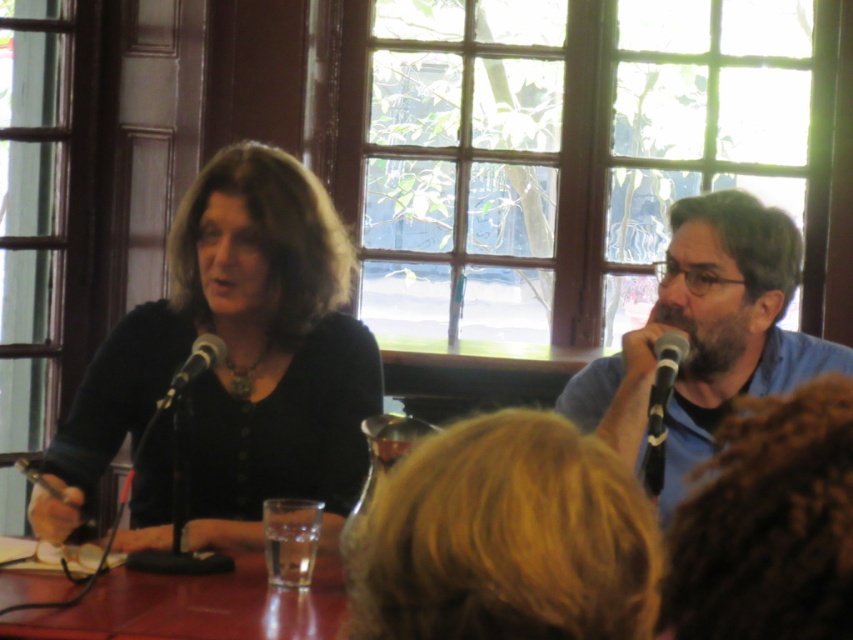
Question: Estimate the real-world distances between objects in this image. Which object is closer to the black metallic microphone at left?

Choices:
 (A) matte black shirt at center
 (B) blue matte shirt at right

Answer: (A)

Question: Which object is positioned closest to the transparent glass table at center?

Choices:
 (A) matte black shirt at center
 (B) black metallic microphone at left
 (C) black plastic microphone at right
 (D) blue matte shirt at right

Answer: (A)

Question: Which of the following is the farthest from the observer?

Choices:
 (A) (242, 250)
 (B) (167, 404)

Answer: (A)

Question: Can you confirm if matte black shirt at center is positioned below transparent glass table at center?

Choices:
 (A) no
 (B) yes

Answer: (A)

Question: Does transparent glass table at center have a lesser width compared to black plastic microphone at right?

Choices:
 (A) no
 (B) yes

Answer: (A)

Question: Does matte black shirt at center have a lesser width compared to black plastic microphone at right?

Choices:
 (A) yes
 (B) no

Answer: (B)